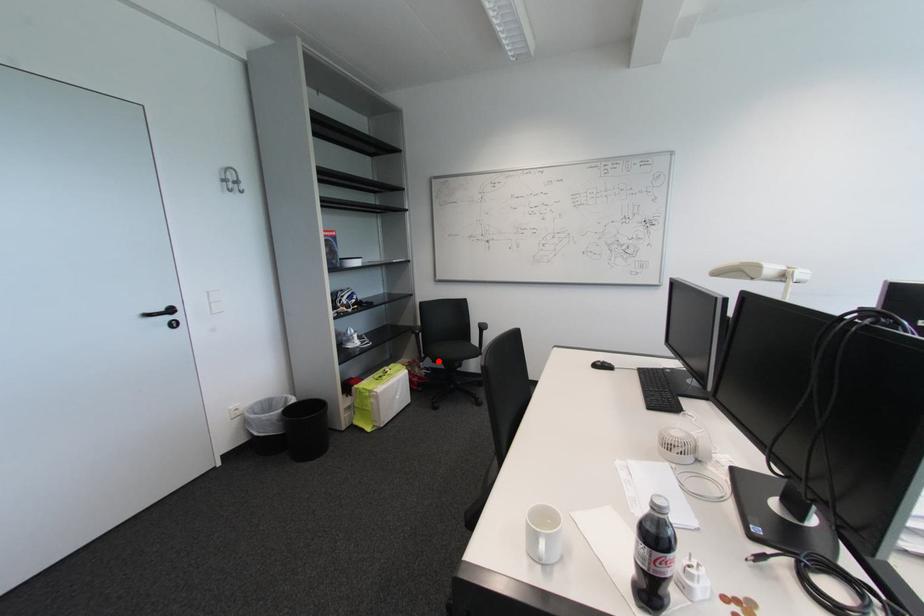
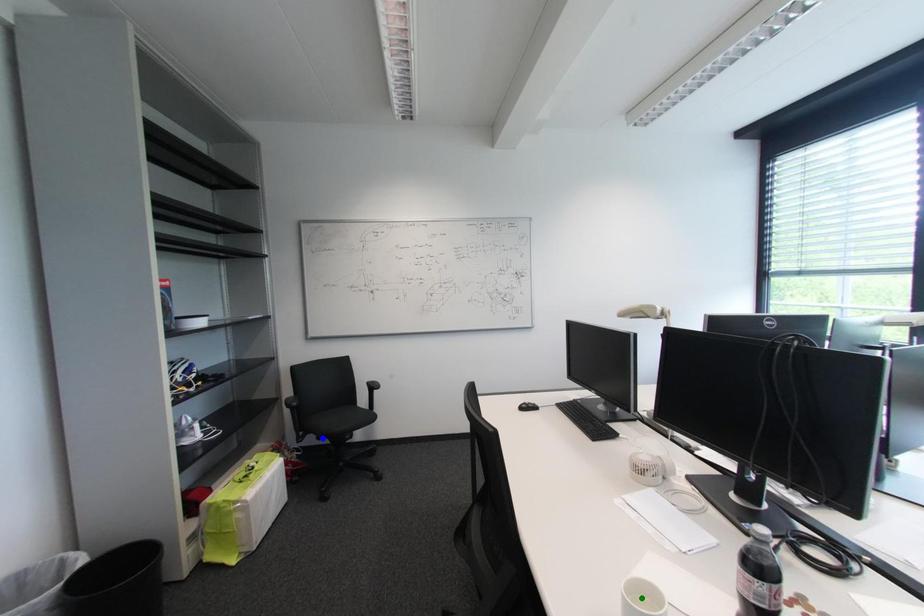
Question: I am providing you with two images of the same scene from different viewpoints. A red point is marked on the first image. You are given multiple points on the second image. Which spot in image 2 lines up with the point in image 1?

Choices:
 (A) blue point
 (B) yellow point
 (C) green point

Answer: (A)